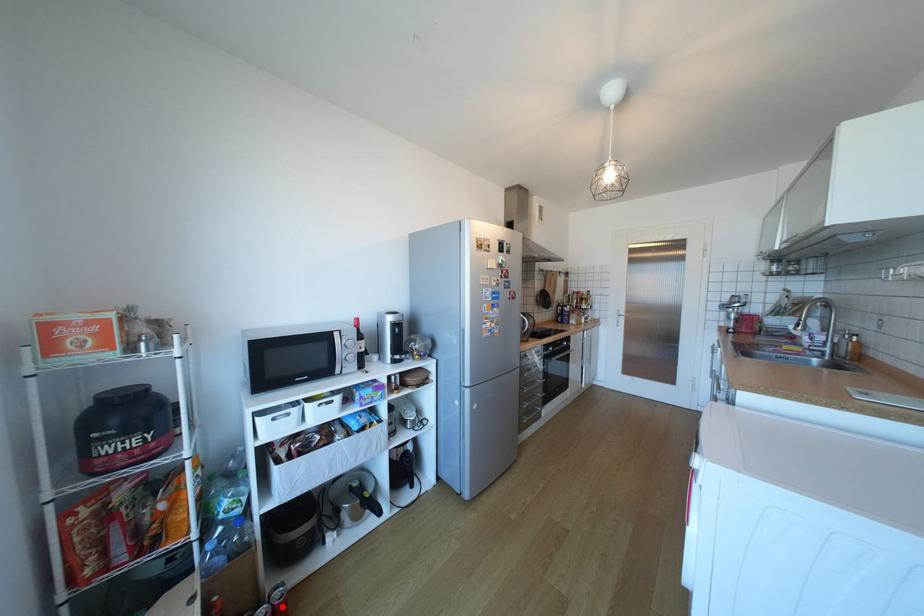
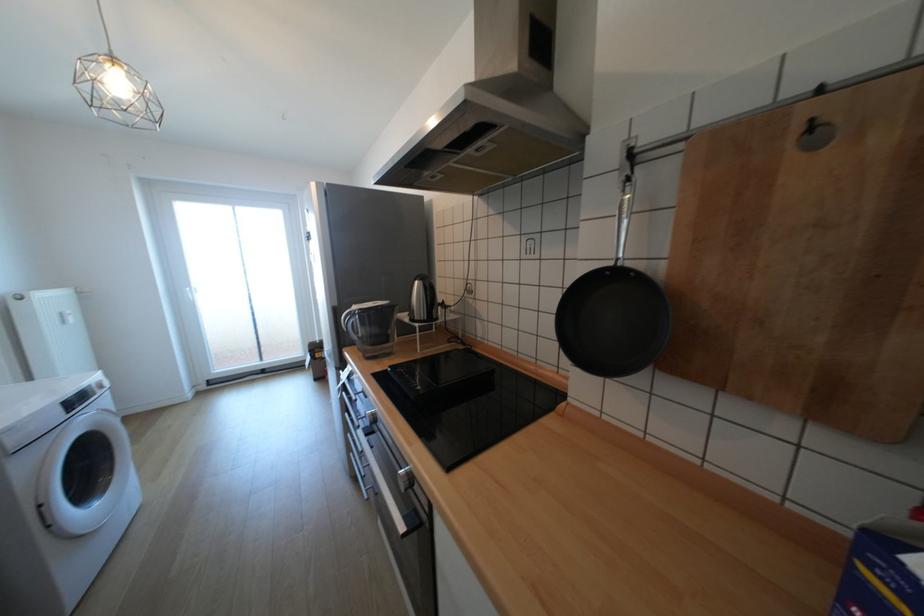
Question: I am providing you with two images of the same scene from different viewpoints. A red point is marked on the first image. Is the red point's position out of view in image 2?

Choices:
 (A) Yes
 (B) No

Answer: (A)